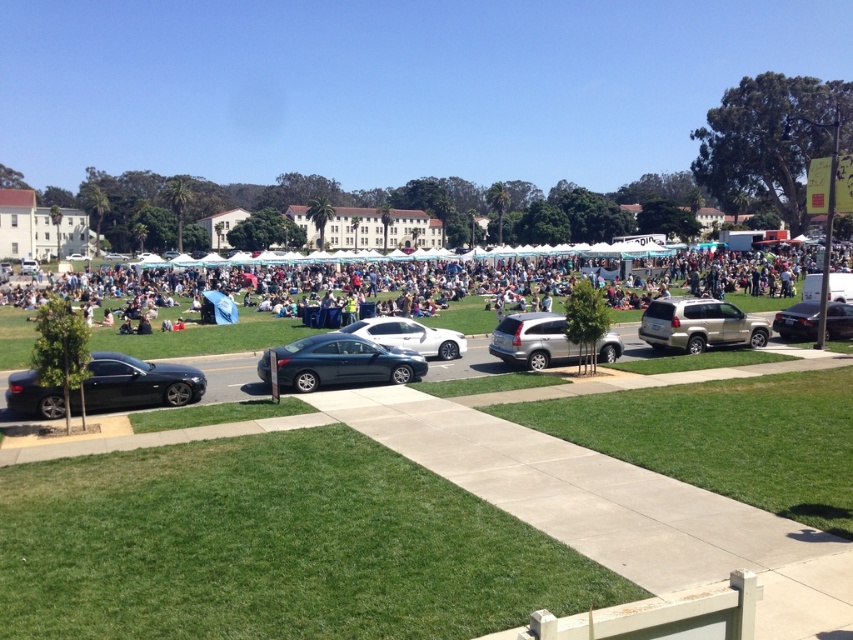
You are a parking attendant who needs to fit a tall delivery van into a parking spot. You see the satin silver sedan at center and the satin black sedan at right. Which car should you move to make space for the van?

You should move the satin black sedan at right because it has a greater height than the satin silver sedan at center, so removing it would free up more vertical space for the tall delivery van.

You are at the coordinates point 0.5, 0.4. Which direction should you move to reach the satin dark blue sedan at center?

The satin dark blue sedan at center is located at point (343, 362). Since your current position is at (340, 320), you should move northeast to reach it.